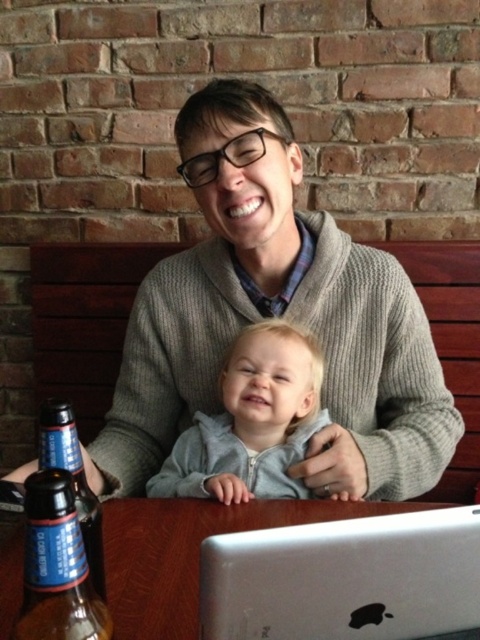
Question: Does silver metallic laptop at center come in front of clear glass bottle at lower left?

Choices:
 (A) no
 (B) yes

Answer: (A)

Question: Can you confirm if gray knitted sweater at center is smaller than silver metallic laptop at center?

Choices:
 (A) no
 (B) yes

Answer: (A)

Question: Which of these objects is positioned closest to the gray knitted sweater at center?

Choices:
 (A) silver metallic laptop at center
 (B) gray fleece jacket at center

Answer: (B)

Question: Does gray knitted sweater at center come in front of silver metallic laptop at center?

Choices:
 (A) yes
 (B) no

Answer: (B)

Question: Which point appears farthest from the camera in this image?

Choices:
 (A) (249, 346)
 (B) (57, 508)

Answer: (A)

Question: Which of these objects is positioned closest to the silver metallic laptop at center?

Choices:
 (A) brown glass bottle at lower left
 (B) clear glass bottle at lower left
 (C) gray fleece jacket at center
 (D) gray knitted sweater at center

Answer: (B)